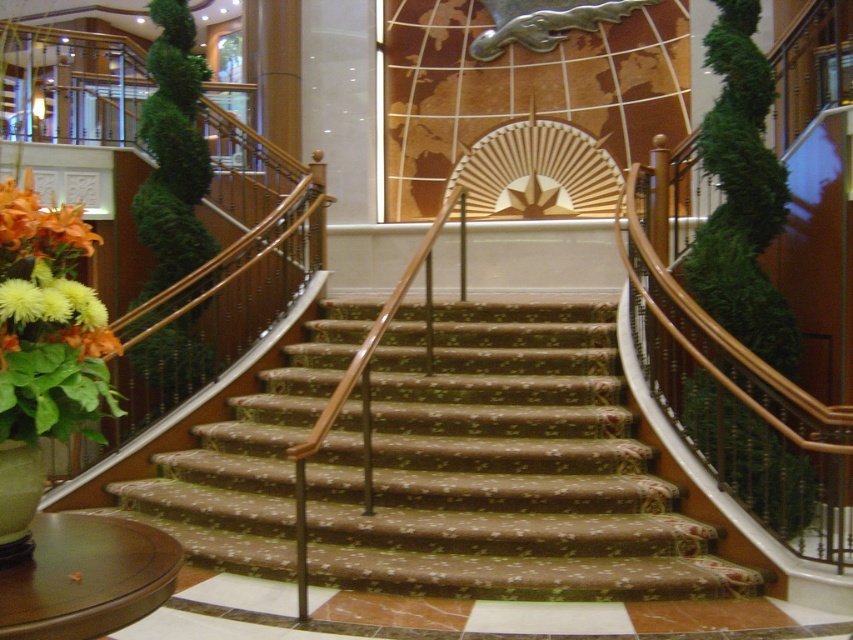
You are a delivery person carrying a large package and need to navigate the staircase. The orange matte flower at lower left and brown textured carpet at center are in your path. Which object will you encounter first as you ascend the staircase?

The brown textured carpet at center will be encountered first because the orange matte flower at lower left is positioned behind it, meaning the carpet is closer to the ascending path.

You are standing at the bottom of the staircase and notice two flowers at the lower left corner. Which flower is positioned more to the right between the yellow matte flower at lower left and the orange matte flower at lower left?

The yellow matte flower at lower left is positioned more to the right compared to the orange matte flower at lower left.